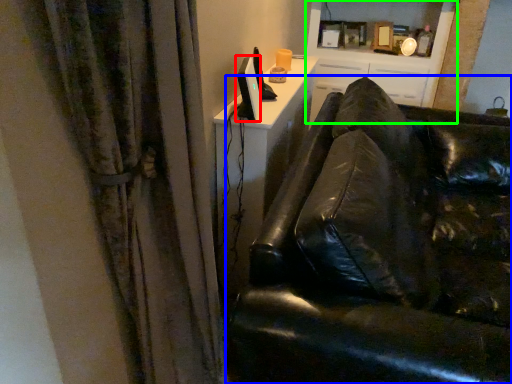
Question: Which object is positioned closest to computer monitor (highlighted by a red box)? Select from studio couch (highlighted by a blue box) and entertainment center (highlighted by a green box).

Choices:
 (A) studio couch
 (B) entertainment center

Answer: (A)